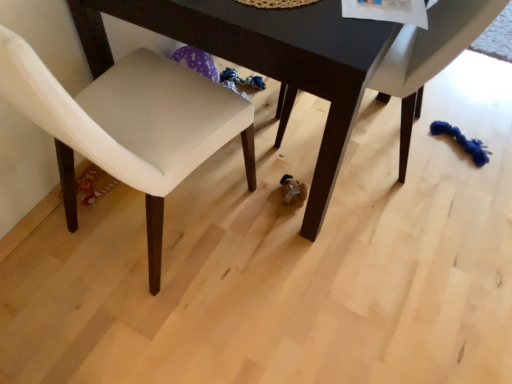
Identify the location of free spot in front of white leather chair at lower left, the 2th chair in the right-to-left sequence. This screenshot has width=512, height=384. (145, 327).